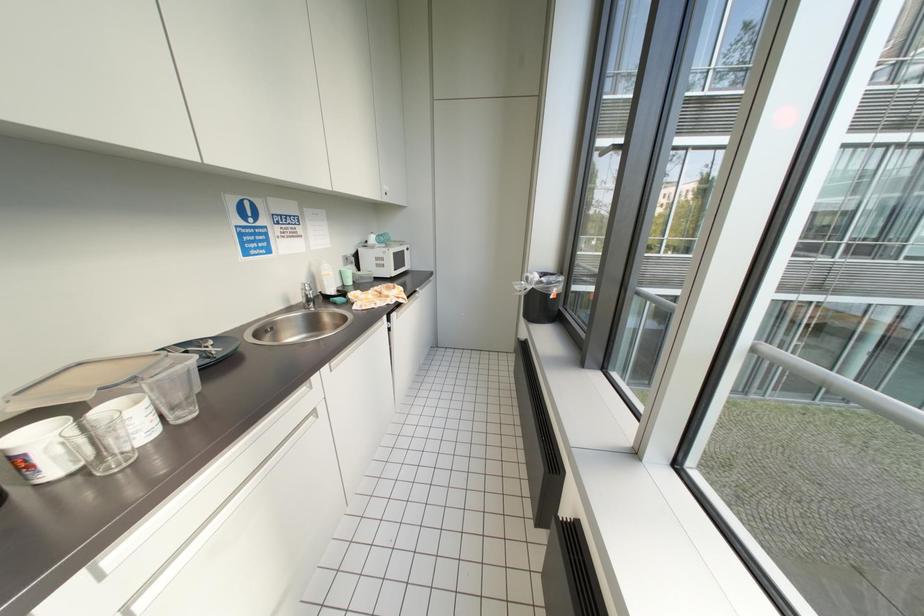
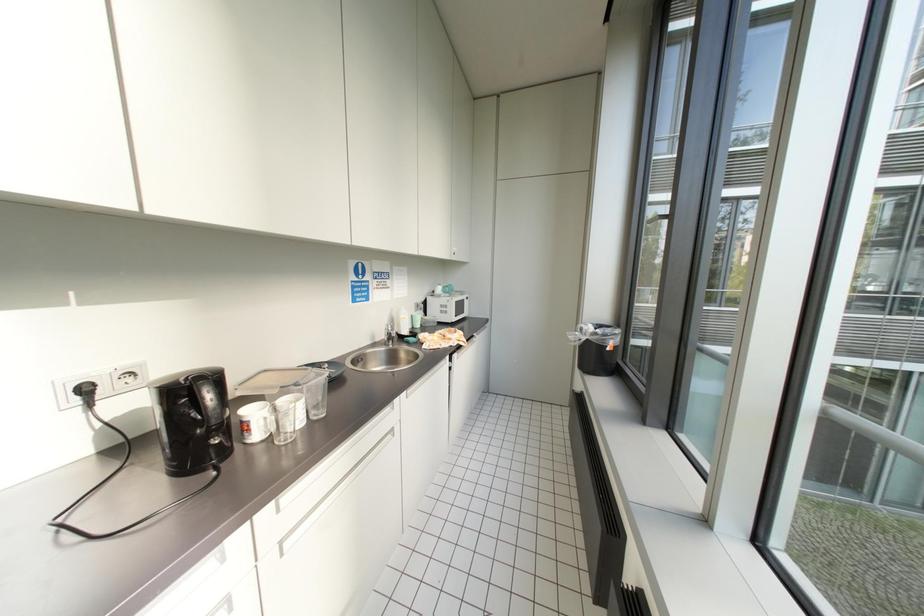
Question: The camera is either moving clockwise (left) or counter-clockwise (right) around the object. The first image is from the beginning of the video and the second image is from the end. Is the camera moving left or right when shooting the video?

Choices:
 (A) Left
 (B) Right

Answer: (B)